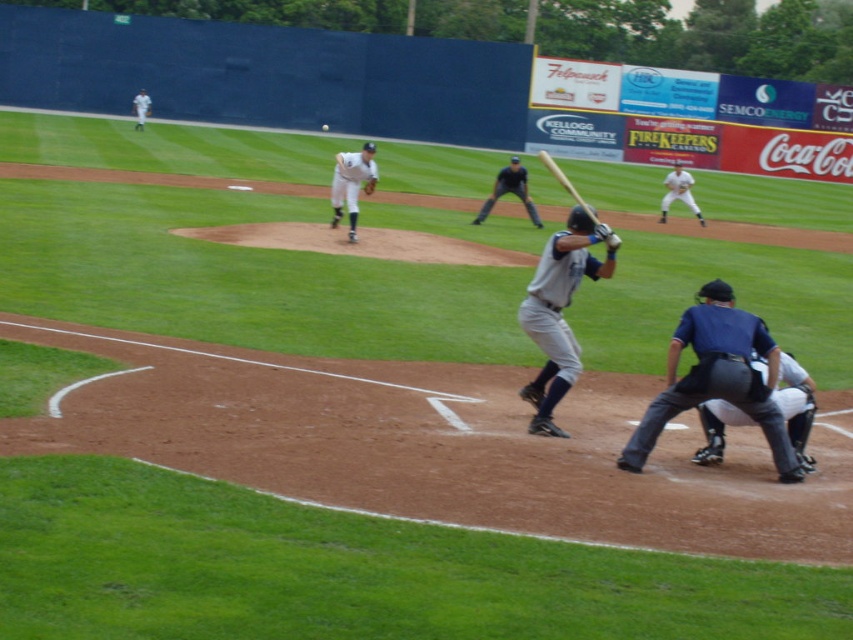
You are a coach observing the baseball game. You notice the gray matte baseball bat at center. Can you determine its exact position on the field using the coordinate system provided?

The gray matte baseball bat at center is located at point coordinates of [558,312].

You are a photographer standing at the edge of the field. You need to capture a photo where the dark blue uniform at lower right and the white matte baseball at upper left are both visible. Based on their positions, which object is located to the right of the other?

The dark blue uniform at lower right is positioned on the right side of white matte baseball at upper left.

From the picture: You are a coach observing the baseball game. You notice the gray matte baseball bat at center and the dark blue leather glove at lower right. Which object is positioned more to the left side of the image?

The gray matte baseball bat at center is positioned more to the left side of the image than the dark blue leather glove at lower right.